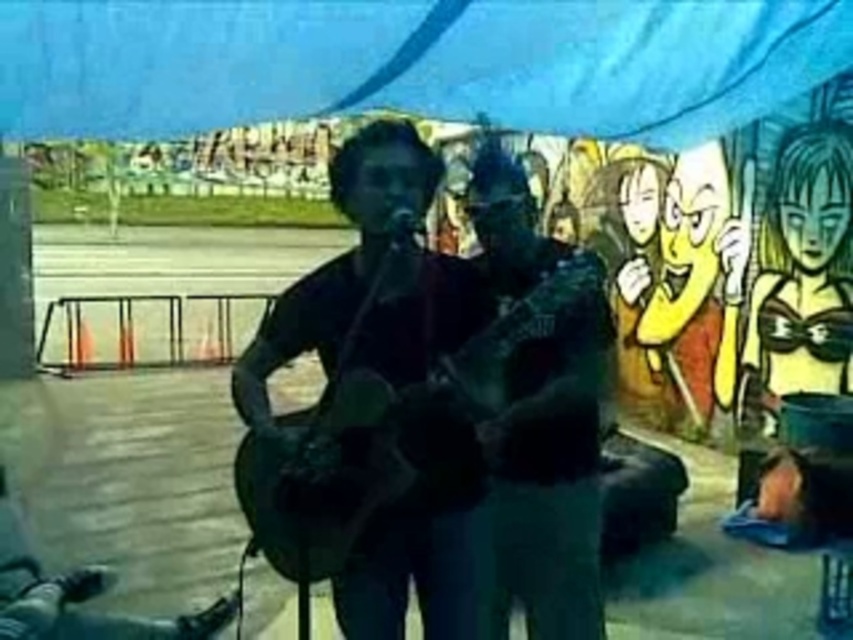
Question: Which object is farther from the camera taking this photo?

Choices:
 (A) wooden acoustic guitar at center
 (B) dark green fabric guitar at center

Answer: (B)

Question: Does wooden acoustic guitar at center come behind dark green fabric guitar at center?

Choices:
 (A) yes
 (B) no

Answer: (B)

Question: Which point appears farthest from the camera in this image?

Choices:
 (A) (432, 282)
 (B) (498, 577)

Answer: (B)

Question: Among these points, which one is nearest to the camera?

Choices:
 (A) (531, 445)
 (B) (273, 528)

Answer: (B)

Question: Considering the relative positions of wooden acoustic guitar at center and dark green fabric guitar at center in the image provided, where is wooden acoustic guitar at center located with respect to dark green fabric guitar at center?

Choices:
 (A) above
 (B) below

Answer: (A)

Question: Is wooden acoustic guitar at center to the left of dark green fabric guitar at center from the viewer's perspective?

Choices:
 (A) yes
 (B) no

Answer: (A)